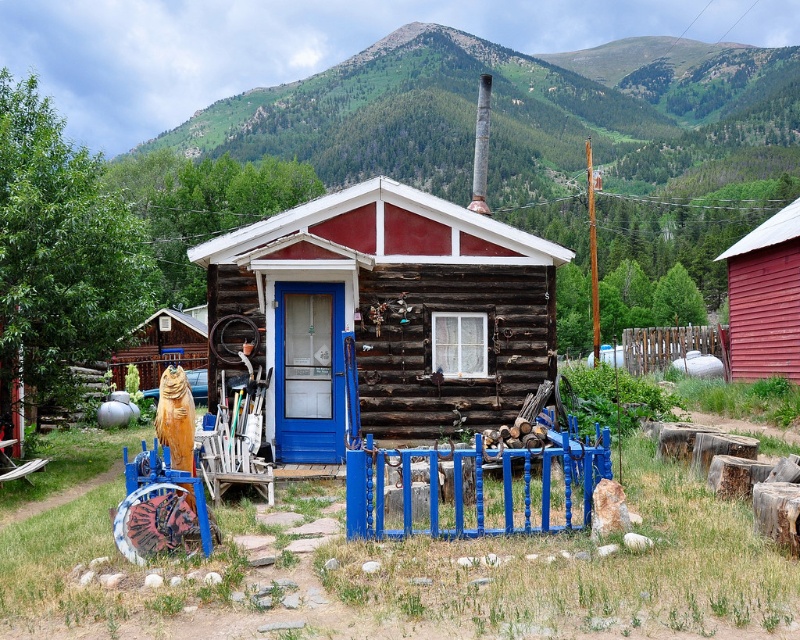
Does wooden cabin at center appear on the left side of wooden fence at right?

Correct, you'll find wooden cabin at center to the left of wooden fence at right.

Between wooden cabin at center and wooden fence at right, which one appears on the left side from the viewer's perspective?

wooden cabin at center

What are the coordinates of `wooden cabin at center` in the screenshot? It's located at (381, 316).

Is green forested mountain at upper center taller than wooden fence at right?

Indeed, green forested mountain at upper center has a greater height compared to wooden fence at right.

What do you see at coordinates (508, 112) in the screenshot?
I see `green forested mountain at upper center` at bounding box center [508, 112].

What do you see at coordinates (508, 112) in the screenshot? I see `green forested mountain at upper center` at bounding box center [508, 112].

This screenshot has height=640, width=800. I want to click on green forested mountain at upper center, so click(508, 112).

Where is `green forested mountain at upper center`? The image size is (800, 640). green forested mountain at upper center is located at coordinates (508, 112).

Who is more forward, (505, 93) or (752, 260)?

Point (752, 260) is in front.

Which is in front, point (532, 163) or point (786, 291)?

Point (786, 291) is more forward.

Identify the location of green forested mountain at upper center. This screenshot has height=640, width=800. (508, 112).